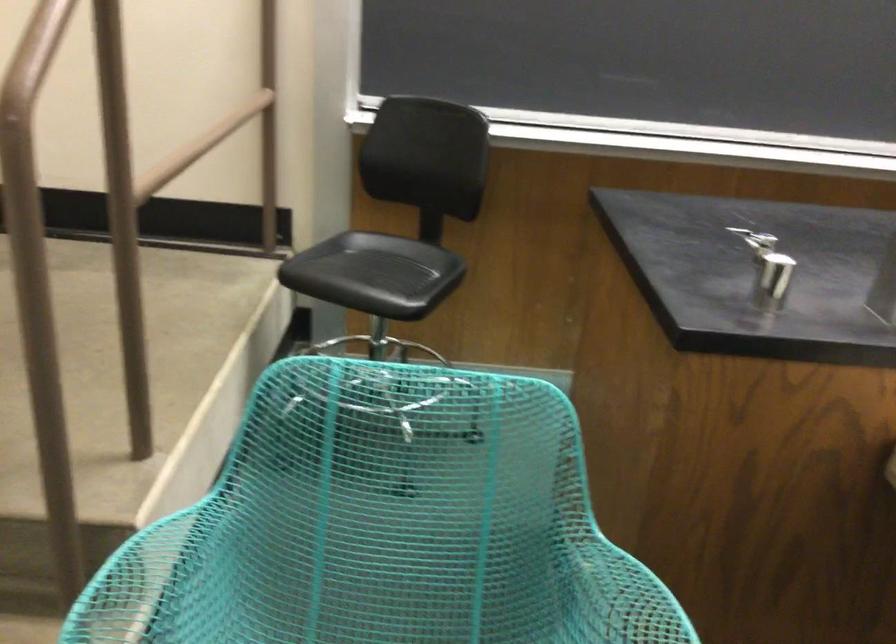
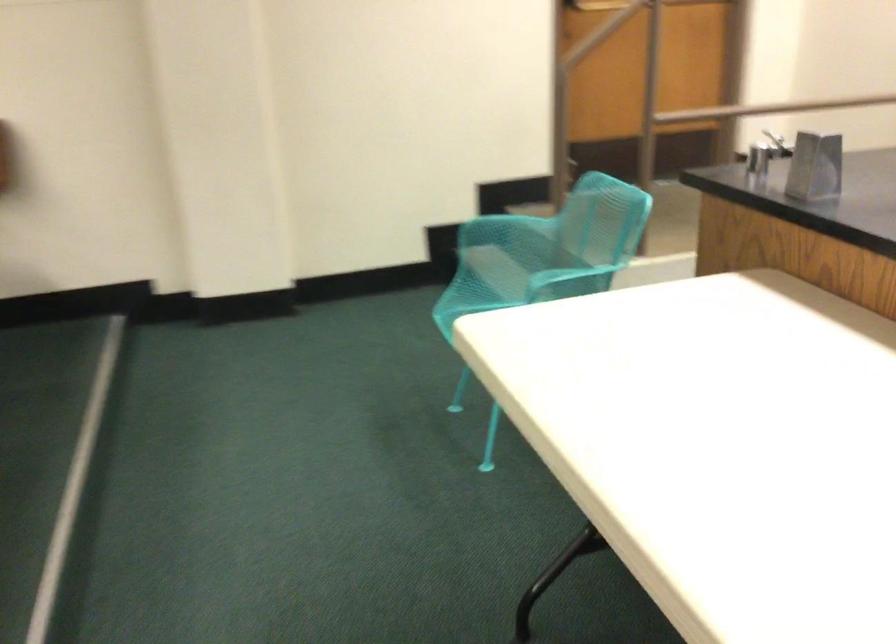
Locate, in the second image, the point that corresponds to (108,574) in the first image.

(494, 218)